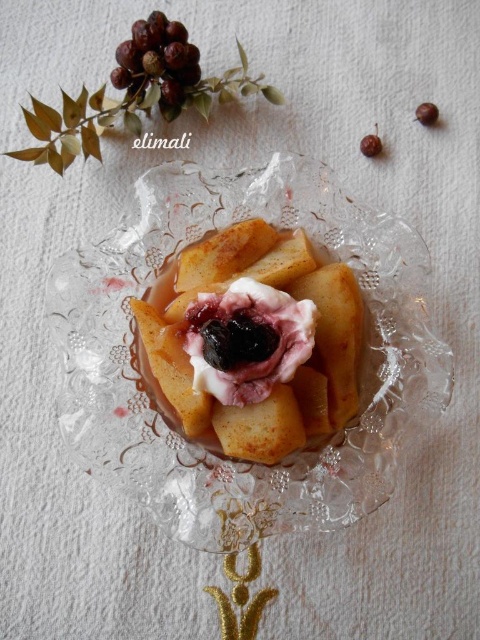
This screenshot has width=480, height=640. Describe the element at coordinates (372, 145) in the screenshot. I see `brown matte hazelnut at upper right` at that location.

Measure the distance between brown matte hazelnut at upper right and brown matte berry at upper right.

They are 4.46 centimeters apart.

Who is more distant from viewer, [361,150] or [434,124]?

The point [434,124] is behind.

The width and height of the screenshot is (480, 640). I want to click on brown matte hazelnut at upper right, so click(x=372, y=145).

Is point (96, 300) positioned in front of point (360, 145)?

Yes, it is in front of point (360, 145).

Who is more forward, (96, 419) or (365, 145)?

Point (96, 419) is more forward.

Find the location of `clear glass platter at center`. clear glass platter at center is located at coordinates (204, 449).

Identify the location of brown matte berries at upper left. The width and height of the screenshot is (480, 640). (156, 65).

Can you confirm if brown matte berries at upper left is smaller than brown matte hazelnut at upper right?

No.

Between point (137, 22) and point (376, 145), which one is positioned behind?

Positioned behind is point (376, 145).

The width and height of the screenshot is (480, 640). I want to click on brown matte berries at upper left, so click(x=156, y=65).